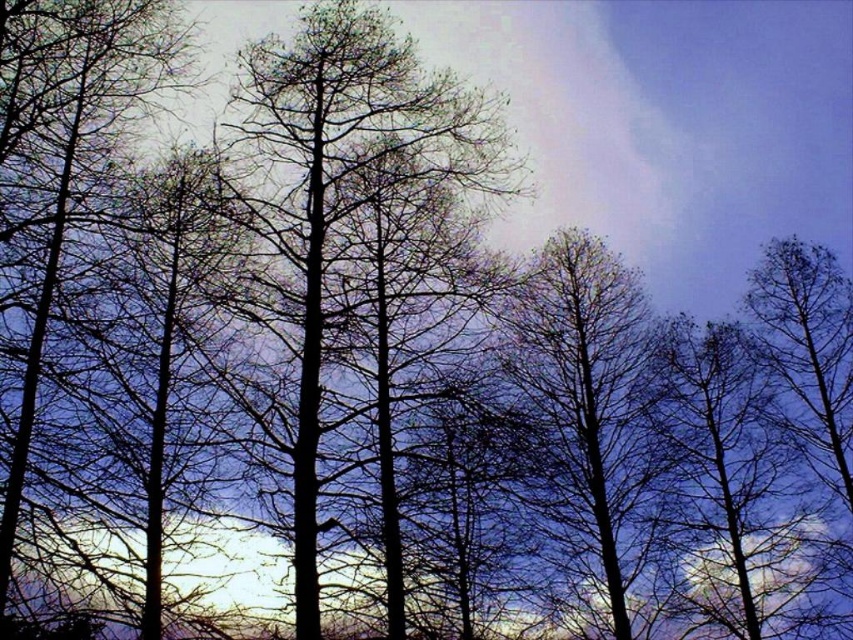
Question: Does smooth bark tree at center have a greater width compared to silhouette bare tree at left?

Choices:
 (A) no
 (B) yes

Answer: (B)

Question: Which is nearer to the silhouette bare tree at left?

Choices:
 (A) bare branches at center
 (B) smooth bark tree at center

Answer: (B)

Question: Considering the relative positions of smooth bark tree at center and bare branches at center in the image provided, where is smooth bark tree at center located with respect to bare branches at center?

Choices:
 (A) left
 (B) right

Answer: (A)

Question: Which point is farther to the camera?

Choices:
 (A) (236, 214)
 (B) (146, 52)
 (C) (601, 460)

Answer: (C)

Question: Does smooth bark tree at center appear under bare branches at center?

Choices:
 (A) yes
 (B) no

Answer: (B)

Question: Which point is closer to the camera?

Choices:
 (A) (0, 259)
 (B) (396, 132)
 (C) (519, 388)

Answer: (A)